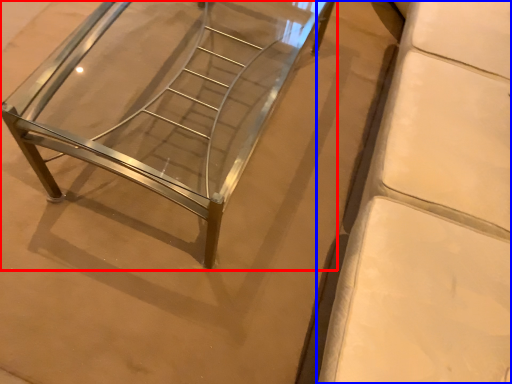
Question: Among these objects, which one is farthest to the camera, furniture (highlighted by a red box) or furniture (highlighted by a blue box)?

Choices:
 (A) furniture
 (B) furniture

Answer: (A)